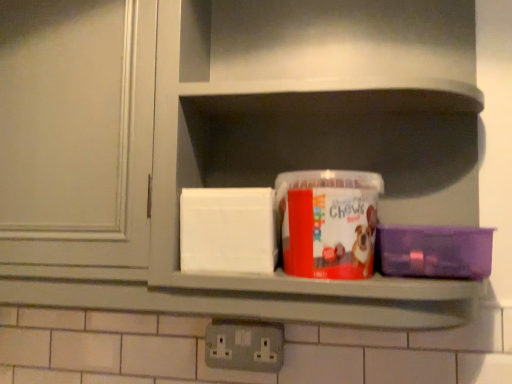
Question: From the image's perspective, is matte plastic container at center over gray plastic electrical outlet at lower center?

Choices:
 (A) yes
 (B) no

Answer: (A)

Question: Is matte plastic container at center smaller than gray plastic electrical outlet at lower center?

Choices:
 (A) yes
 (B) no

Answer: (B)

Question: Considering the relative sizes of matte plastic container at center and gray plastic electrical outlet at lower center in the image provided, is matte plastic container at center thinner than gray plastic electrical outlet at lower center?

Choices:
 (A) yes
 (B) no

Answer: (B)

Question: Is matte plastic container at center at the right side of gray plastic electrical outlet at lower center?

Choices:
 (A) yes
 (B) no

Answer: (A)

Question: Can you confirm if matte plastic container at center is positioned to the left of gray plastic electrical outlet at lower center?

Choices:
 (A) no
 (B) yes

Answer: (A)

Question: From a real-world perspective, is translucent plastic container at center, the 1th box positioned from the left, positioned above or below matte plastic container at center?

Choices:
 (A) below
 (B) above

Answer: (A)

Question: Considering their positions, is translucent plastic container at center, the 1th box positioned from the left, located in front of or behind matte plastic container at center?

Choices:
 (A) front
 (B) behind

Answer: (B)

Question: Is point (304, 178) positioned closer to the camera than point (472, 134)?

Choices:
 (A) closer
 (B) farther

Answer: (A)

Question: Is translucent plastic container at center, the 1th box positioned from the left, taller or shorter than matte plastic container at center?

Choices:
 (A) tall
 (B) short

Answer: (B)

Question: From the image's perspective, is translucent plastic container at center, the 1th box positioned from the left, above or below purple plastic container at right, positioned as the second box in left-to-right order?

Choices:
 (A) below
 (B) above

Answer: (B)

Question: Is translucent plastic container at center, the 1th box positioned from the left, taller or shorter than purple plastic container at right, which appears as the 1th box when viewed from the right?

Choices:
 (A) short
 (B) tall

Answer: (B)

Question: Would you say translucent plastic container at center, the 1th box positioned from the left, is to the left or to the right of purple plastic container at right, which appears as the 1th box when viewed from the right, in the picture?

Choices:
 (A) left
 (B) right

Answer: (A)

Question: Considering their positions, is translucent plastic container at center, the 1th box positioned from the left, located in front of or behind purple plastic container at right, which appears as the 1th box when viewed from the right?

Choices:
 (A) front
 (B) behind

Answer: (A)

Question: In terms of height, does purple plastic container at right, positioned as the second box in left-to-right order, look taller or shorter compared to gray plastic electrical outlet at lower center?

Choices:
 (A) tall
 (B) short

Answer: (A)

Question: Considering the positions of purple plastic container at right, which appears as the 1th box when viewed from the right, and gray plastic electrical outlet at lower center in the image, is purple plastic container at right, which appears as the 1th box when viewed from the right, wider or thinner than gray plastic electrical outlet at lower center?

Choices:
 (A) thin
 (B) wide

Answer: (B)